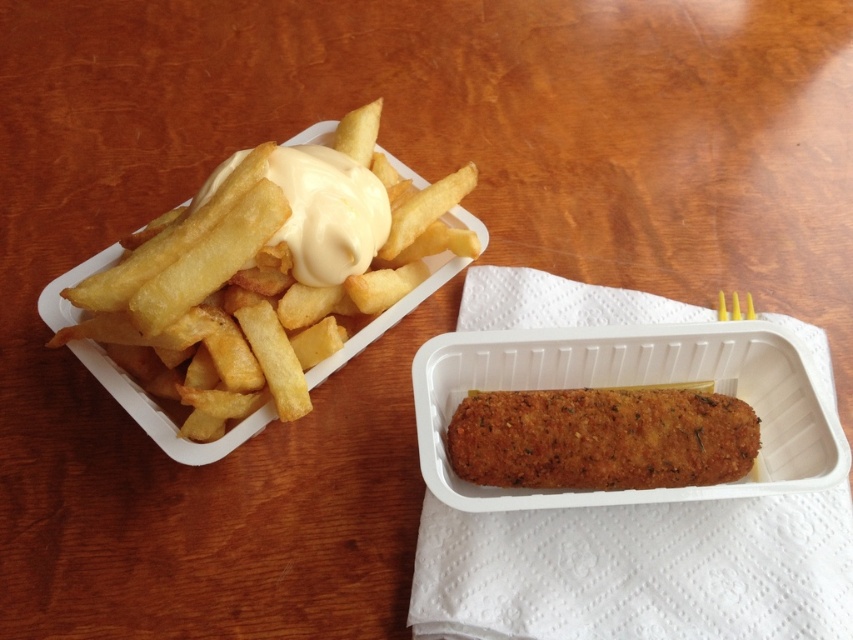
Question: Which point is farther to the camera?

Choices:
 (A) (273, 364)
 (B) (538, 448)

Answer: (A)

Question: Which object is closer to the camera taking this photo?

Choices:
 (A) golden crispy french fries at left
 (B) golden crispy croquette at center

Answer: (A)

Question: Does golden crispy french fries at left appear on the left side of golden crispy croquette at center?

Choices:
 (A) yes
 (B) no

Answer: (A)

Question: Is golden crispy french fries at left further to camera compared to golden crispy croquette at center?

Choices:
 (A) yes
 (B) no

Answer: (B)

Question: Can you confirm if golden crispy french fries at left is positioned below golden crispy croquette at center?

Choices:
 (A) yes
 (B) no

Answer: (B)